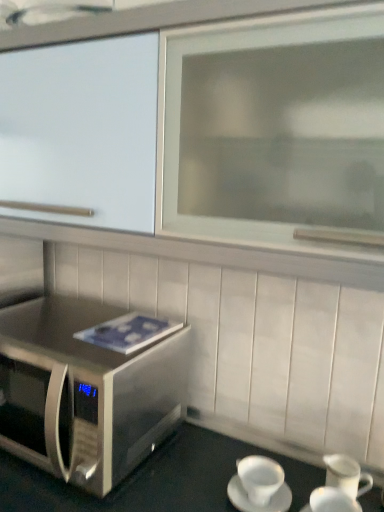
Describe the element at coordinates (86, 389) in the screenshot. This screenshot has height=512, width=384. I see `stainless steel microwave oven at lower left` at that location.

Locate an element on the screen. The height and width of the screenshot is (512, 384). white ceramic cup at lower right, the first coffee cup positioned from the left is located at coordinates (260, 478).

You are a GUI agent. You are given a task and a screenshot of the screen. Output one action in this format:
    pyautogui.click(x=<x>, y=<y>)
    Task: Click on the stainless steel microwave at lower left
    This screenshot has width=384, height=512.
    Given the screenshot: What is the action you would take?
    pyautogui.click(x=157, y=479)

Locate an element on the screen. stainless steel microwave oven at lower left is located at coordinates coord(86,389).

Looking at the image, does stainless steel microwave at lower left seem bigger or smaller compared to white ceramic cup at lower right, marked as the second coffee cup in a right-to-left arrangement?

Clearly, stainless steel microwave at lower left is larger in size than white ceramic cup at lower right, marked as the second coffee cup in a right-to-left arrangement.

Is stainless steel microwave at lower left touching white ceramic cup at lower right, marked as the second coffee cup in a right-to-left arrangement?

stainless steel microwave at lower left and white ceramic cup at lower right, marked as the second coffee cup in a right-to-left arrangement, are clearly separated.

Who is taller, stainless steel microwave at lower left or white ceramic cup at lower right, marked as the second coffee cup in a right-to-left arrangement?

stainless steel microwave at lower left is taller.

Between white ceramic cup at lower right, marked as the second coffee cup in a right-to-left arrangement, and stainless steel microwave oven at lower left, which one is positioned in front?

stainless steel microwave oven at lower left.

Between white ceramic cup at lower right, the first coffee cup positioned from the left, and stainless steel microwave oven at lower left, which one appears on the left side from the viewer's perspective?

stainless steel microwave oven at lower left.

Does point (250, 486) come in front of point (95, 307)?

Yes, point (250, 486) is closer to viewer.

You are a GUI agent. You are given a task and a screenshot of the screen. Output one action in this format:
    pyautogui.click(x=<x>, y=<y>)
    Task: Click on the coffee cup behind the white ceramic coffee cup at lower right, which is counted as the 2th coffee cup, starting from the left
    The image size is (384, 512).
    Given the screenshot: What is the action you would take?
    pyautogui.click(x=260, y=478)

Is white ceramic coffee cup at lower right, which is counted as the 2th coffee cup, starting from the left, inside the boundaries of white ceramic cup at lower right, marked as the second coffee cup in a right-to-left arrangement, or outside?

white ceramic coffee cup at lower right, which is counted as the 2th coffee cup, starting from the left, is not enclosed by white ceramic cup at lower right, marked as the second coffee cup in a right-to-left arrangement.

Considering the sizes of objects white ceramic coffee cup at lower right, which is counted as the 2th coffee cup, starting from the left, and white ceramic cup at lower right, the first coffee cup positioned from the left, in the image provided, who is smaller, white ceramic coffee cup at lower right, which is counted as the 2th coffee cup, starting from the left, or white ceramic cup at lower right, the first coffee cup positioned from the left,?

Smaller between the two is white ceramic cup at lower right, the first coffee cup positioned from the left.

Relative to white ceramic cup at lower right, marked as the second coffee cup in a right-to-left arrangement, is white ceramic coffee cup at lower right, which appears as the 1th coffee cup when viewed from the right, in front or behind?

Visually, white ceramic coffee cup at lower right, which appears as the 1th coffee cup when viewed from the right, is located in front of white ceramic cup at lower right, marked as the second coffee cup in a right-to-left arrangement.

Is stainless steel microwave at lower left at the back of white ceramic cup at lower right, marked as the second coffee cup in a right-to-left arrangement?

Yes, white ceramic cup at lower right, marked as the second coffee cup in a right-to-left arrangement, is positioned with its back facing stainless steel microwave at lower left.

From a real-world perspective, who is located higher, white ceramic cup at lower right, the first coffee cup positioned from the left, or stainless steel microwave at lower left?

From a 3D spatial view, white ceramic cup at lower right, the first coffee cup positioned from the left, is above.

From the image's perspective, does white ceramic cup at lower right, marked as the second coffee cup in a right-to-left arrangement, appear lower than stainless steel microwave at lower left?

No.

Is white ceramic cup at lower right, marked as the second coffee cup in a right-to-left arrangement, taller or shorter than stainless steel microwave at lower left?

Clearly, white ceramic cup at lower right, marked as the second coffee cup in a right-to-left arrangement, is shorter compared to stainless steel microwave at lower left.

Is stainless steel microwave oven at lower left far from white ceramic coffee cup at lower right, which appears as the 1th coffee cup when viewed from the right?

That's not correct — stainless steel microwave oven at lower left is a little close to white ceramic coffee cup at lower right, which appears as the 1th coffee cup when viewed from the right.

From a real-world perspective, is stainless steel microwave oven at lower left positioned under white ceramic coffee cup at lower right, which is counted as the 2th coffee cup, starting from the left, based on gravity?

No, from a real-world perspective, stainless steel microwave oven at lower left is not under white ceramic coffee cup at lower right, which is counted as the 2th coffee cup, starting from the left.

I want to click on microwave oven above the white ceramic coffee cup at lower right, which appears as the 1th coffee cup when viewed from the right (from the image's perspective), so coord(86,389).

Does stainless steel microwave oven at lower left have a lesser width compared to white ceramic coffee cup at lower right, which appears as the 1th coffee cup when viewed from the right?

Incorrect, the width of stainless steel microwave oven at lower left is not less than that of white ceramic coffee cup at lower right, which appears as the 1th coffee cup when viewed from the right.

Is stainless steel microwave at lower left next to white ceramic coffee cup at lower right, which is counted as the 2th coffee cup, starting from the left, and touching it?

No, stainless steel microwave at lower left is not with white ceramic coffee cup at lower right, which is counted as the 2th coffee cup, starting from the left.

From a real-world perspective, count 2nd coffee cups upward from the stainless steel microwave at lower left and point to it. Please provide its 2D coordinates.

[(332, 501)]

Does stainless steel microwave at lower left appear on the right side of white ceramic coffee cup at lower right, which appears as the 1th coffee cup when viewed from the right?

Incorrect, stainless steel microwave at lower left is not on the right side of white ceramic coffee cup at lower right, which appears as the 1th coffee cup when viewed from the right.

Does stainless steel microwave at lower left have a lesser height compared to white ceramic coffee cup at lower right, which is counted as the 2th coffee cup, starting from the left?

In fact, stainless steel microwave at lower left may be taller than white ceramic coffee cup at lower right, which is counted as the 2th coffee cup, starting from the left.

Looking at this image, which is closer to the camera, (275, 473) or (329, 496)?

Point (275, 473) appears to be farther away from the viewer than point (329, 496).

Is white ceramic cup at lower right, marked as the second coffee cup in a right-to-left arrangement, thinner than white ceramic coffee cup at lower right, which is counted as the 2th coffee cup, starting from the left?

Incorrect, the width of white ceramic cup at lower right, marked as the second coffee cup in a right-to-left arrangement, is not less than that of white ceramic coffee cup at lower right, which is counted as the 2th coffee cup, starting from the left.

Would you say white ceramic cup at lower right, the first coffee cup positioned from the left, is outside white ceramic coffee cup at lower right, which is counted as the 2th coffee cup, starting from the left?

white ceramic cup at lower right, the first coffee cup positioned from the left, lies outside white ceramic coffee cup at lower right, which is counted as the 2th coffee cup, starting from the left,'s area.

Identify the location of table below the white ceramic cup at lower right, the first coffee cup positioned from the left (from the image's perspective). The height and width of the screenshot is (512, 384). (157, 479).

Where is `microwave oven that is on the left side of white ceramic cup at lower right, the first coffee cup positioned from the left`? This screenshot has width=384, height=512. microwave oven that is on the left side of white ceramic cup at lower right, the first coffee cup positioned from the left is located at coordinates (86, 389).

Based on their spatial positions, is stainless steel microwave at lower left or white ceramic cup at lower right, marked as the second coffee cup in a right-to-left arrangement, further from stainless steel microwave oven at lower left?

The object further to stainless steel microwave oven at lower left is white ceramic cup at lower right, marked as the second coffee cup in a right-to-left arrangement.

Based on their spatial positions, is stainless steel microwave at lower left or stainless steel microwave oven at lower left further from white ceramic cup at lower right, marked as the second coffee cup in a right-to-left arrangement?

The object further to white ceramic cup at lower right, marked as the second coffee cup in a right-to-left arrangement, is stainless steel microwave oven at lower left.

Considering their positions, is stainless steel microwave oven at lower left positioned further to stainless steel microwave at lower left than white ceramic coffee cup at lower right, which appears as the 1th coffee cup when viewed from the right?

white ceramic coffee cup at lower right, which appears as the 1th coffee cup when viewed from the right, is positioned further to the anchor stainless steel microwave at lower left.

Which object lies further to the anchor point white ceramic cup at lower right, marked as the second coffee cup in a right-to-left arrangement, stainless steel microwave oven at lower left or white ceramic coffee cup at lower right, which is counted as the 2th coffee cup, starting from the left?

stainless steel microwave oven at lower left.

When comparing their distances from stainless steel microwave at lower left, does stainless steel microwave oven at lower left or white ceramic cup at lower right, marked as the second coffee cup in a right-to-left arrangement, seem further?

stainless steel microwave oven at lower left.

Estimate the real-world distances between objects in this image. Which object is further from stainless steel microwave oven at lower left, white ceramic coffee cup at lower right, which is counted as the 2th coffee cup, starting from the left, or white ceramic cup at lower right, the first coffee cup positioned from the left?

white ceramic coffee cup at lower right, which is counted as the 2th coffee cup, starting from the left, is positioned further to the anchor stainless steel microwave oven at lower left.

Based on their spatial positions, is stainless steel microwave at lower left or white ceramic coffee cup at lower right, which is counted as the 2th coffee cup, starting from the left, closer to white ceramic cup at lower right, the first coffee cup positioned from the left?

white ceramic coffee cup at lower right, which is counted as the 2th coffee cup, starting from the left, is positioned closer to the anchor white ceramic cup at lower right, the first coffee cup positioned from the left.

From the image, which object appears to be nearer to white ceramic coffee cup at lower right, which is counted as the 2th coffee cup, starting from the left, stainless steel microwave oven at lower left or white ceramic cup at lower right, marked as the second coffee cup in a right-to-left arrangement?

Among the two, white ceramic cup at lower right, marked as the second coffee cup in a right-to-left arrangement, is located nearer to white ceramic coffee cup at lower right, which is counted as the 2th coffee cup, starting from the left.

You are a GUI agent. You are given a task and a screenshot of the screen. Output one action in this format:
    pyautogui.click(x=<x>, y=<y>)
    Task: Click on the coffee cup between stainless steel microwave oven at lower left and white ceramic coffee cup at lower right, which is counted as the 2th coffee cup, starting from the left, in the horizontal direction
    
    Given the screenshot: What is the action you would take?
    pyautogui.click(x=260, y=478)

Where is `table between stainless steel microwave oven at lower left and white ceramic coffee cup at lower right, which appears as the 1th coffee cup when viewed from the right, in the horizontal direction`? This screenshot has width=384, height=512. table between stainless steel microwave oven at lower left and white ceramic coffee cup at lower right, which appears as the 1th coffee cup when viewed from the right, in the horizontal direction is located at coordinates (157, 479).

You are a GUI agent. You are given a task and a screenshot of the screen. Output one action in this format:
    pyautogui.click(x=<x>, y=<y>)
    Task: Click on the table situated between stainless steel microwave oven at lower left and white ceramic cup at lower right, the first coffee cup positioned from the left, from left to right
    The height and width of the screenshot is (512, 384).
    Given the screenshot: What is the action you would take?
    pyautogui.click(x=157, y=479)

Find the location of a particular element. coffee cup located between stainless steel microwave at lower left and white ceramic coffee cup at lower right, which is counted as the 2th coffee cup, starting from the left, in the left-right direction is located at coordinates (260, 478).